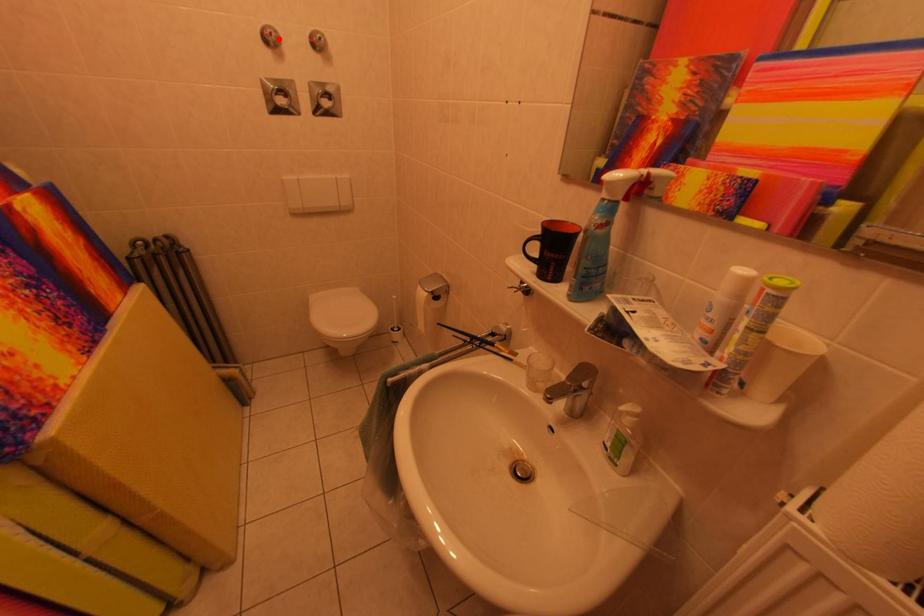
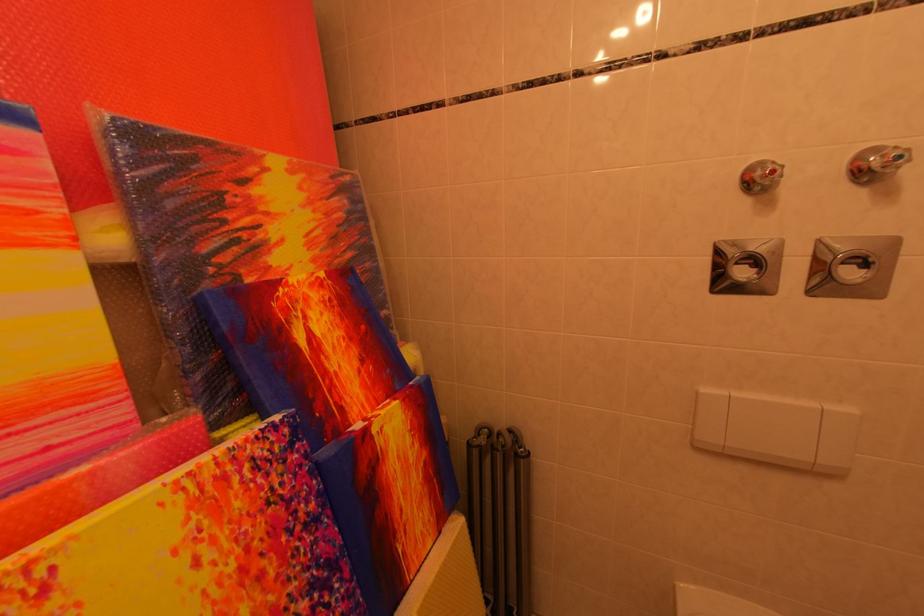
Find the pixel in the second image that matches the highlighted location in the first image.

(782, 176)